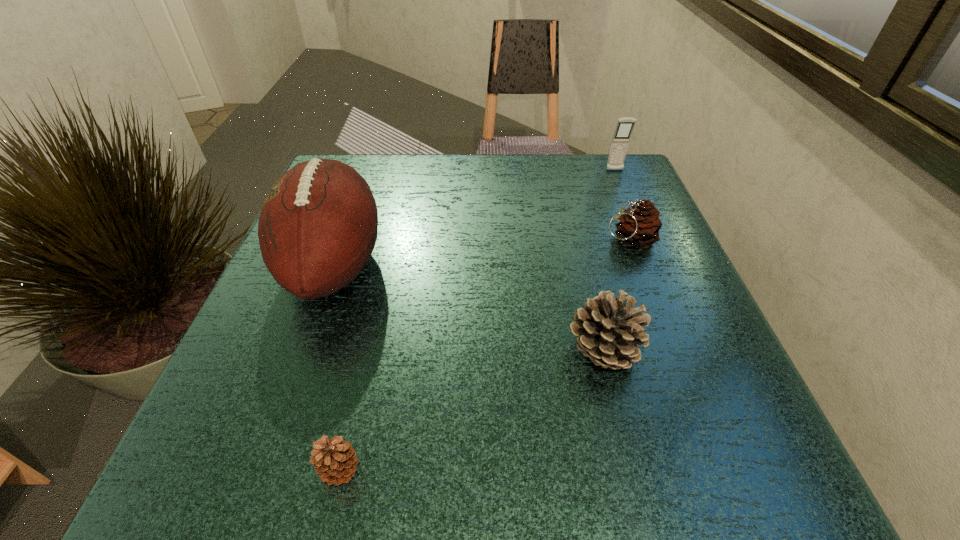
Where is `free space between the football (American) and the tallest pinecone`? The width and height of the screenshot is (960, 540). free space between the football (American) and the tallest pinecone is located at coordinates (468, 308).

Image resolution: width=960 pixels, height=540 pixels. Identify the location of empty location between the tallest object and the cellular telephone. (474, 218).

Where is `free space that is in between the tallest pinecone and the tallest object`? This screenshot has width=960, height=540. free space that is in between the tallest pinecone and the tallest object is located at coordinates (468, 308).

This screenshot has width=960, height=540. I want to click on vacant space that is in between the farthest object and the shortest object, so click(477, 320).

Where is `vacant region between the football (American) and the shortest pinecone`? vacant region between the football (American) and the shortest pinecone is located at coordinates (337, 367).

Locate an element on the screen. The image size is (960, 540). free space between the cellular telephone and the shortest object is located at coordinates (477, 320).

Choose which object is the fourth nearest neighbor to the tallest pinecone. Please provide its 2D coordinates. Your answer should be formatted as a tuple, i.e. [(x, y)], where the tuple contains the x and y coordinates of a point satisfying the conditions above.

[(621, 138)]

Locate which object is the fourth closest to the football (American). Please provide its 2D coordinates. Your answer should be formatted as a tuple, i.e. [(x, y)], where the tuple contains the x and y coordinates of a point satisfying the conditions above.

[(621, 138)]

Select which pinecone appears as the closest to the second nearest pinecone. Please provide its 2D coordinates. Your answer should be formatted as a tuple, i.e. [(x, y)], where the tuple contains the x and y coordinates of a point satisfying the conditions above.

[(639, 226)]

Choose which pinecone is the nearest neighbor to the third shortest object. Please provide its 2D coordinates. Your answer should be formatted as a tuple, i.e. [(x, y)], where the tuple contains the x and y coordinates of a point satisfying the conditions above.

[(639, 226)]